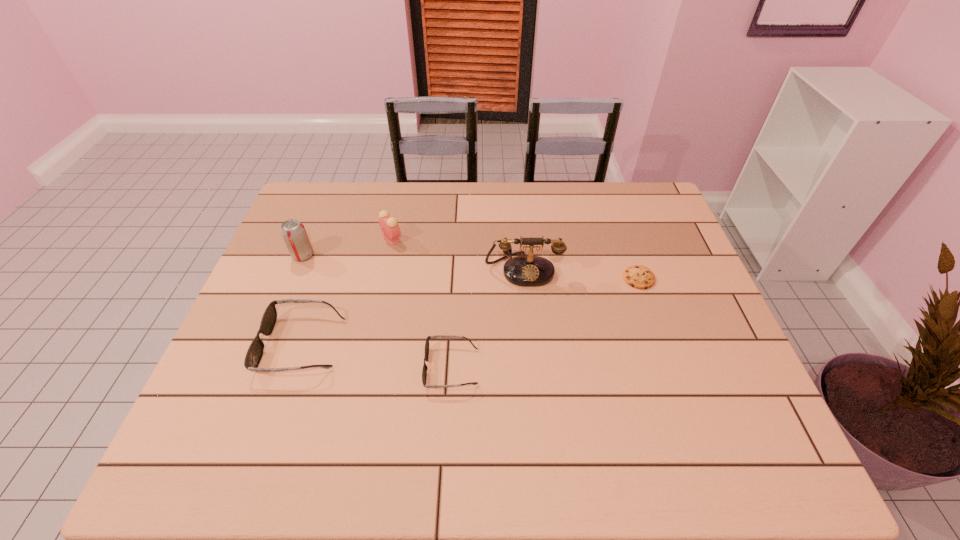
The width and height of the screenshot is (960, 540). What are the coordinates of `the taller sunglasses` in the screenshot? It's located at (254, 354).

Where is `the left sunglasses`? the left sunglasses is located at coordinates (254, 354).

I want to click on the fourth object from left to right, so click(424, 371).

You are a GUI agent. You are given a task and a screenshot of the screen. Output one action in this format:
    pyautogui.click(x=<x>, y=<y>)
    Task: Click on the right sunglasses
    The image size is (960, 540).
    Given the screenshot: What is the action you would take?
    pyautogui.click(x=424, y=371)

In order to click on the third object from left to right in this screenshot , I will do `click(388, 224)`.

You are a GUI agent. You are given a task and a screenshot of the screen. Output one action in this format:
    pyautogui.click(x=<x>, y=<y>)
    Task: Click on the alarm clock
    
    Given the screenshot: What is the action you would take?
    pyautogui.click(x=388, y=224)

You are a GUI agent. You are given a task and a screenshot of the screen. Output one action in this format:
    pyautogui.click(x=<x>, y=<y>)
    Task: Click on the soda can
    
    Given the screenshot: What is the action you would take?
    pyautogui.click(x=294, y=234)

The width and height of the screenshot is (960, 540). Find the location of `the rightmost object`. the rightmost object is located at coordinates (640, 277).

The height and width of the screenshot is (540, 960). What are the coordinates of `cookie` in the screenshot? It's located at (640, 277).

Find the location of `the fifth object from left to right`. the fifth object from left to right is located at coordinates (529, 271).